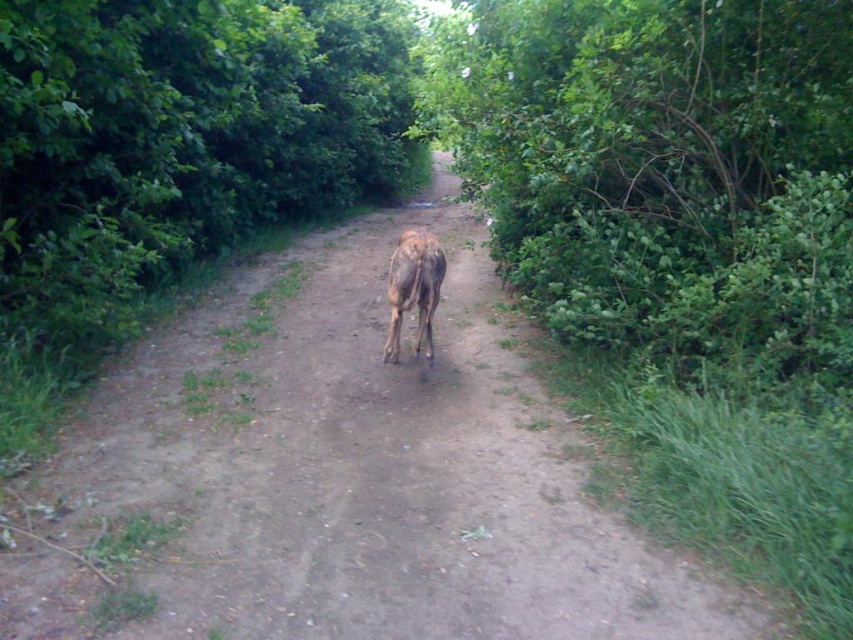
Question: Can you confirm if green leafy bush at right is positioned to the right of brown speckled fur at center?

Choices:
 (A) yes
 (B) no

Answer: (A)

Question: Which object is farther from the camera taking this photo?

Choices:
 (A) brown textured dirt path at center
 (B) green leafy tree at center
 (C) green leafy bush at right
 (D) brown speckled fur at center

Answer: (B)

Question: Does green leafy tree at center have a larger size compared to brown speckled fur at center?

Choices:
 (A) yes
 (B) no

Answer: (B)

Question: Which of the following is the closest to the observer?

Choices:
 (A) (26, 10)
 (B) (405, 262)

Answer: (A)

Question: Which object appears farthest from the camera in this image?

Choices:
 (A) brown speckled fur at center
 (B) green leafy bush at right
 (C) green leafy tree at center

Answer: (C)

Question: Does brown textured dirt path at center appear over green leafy bush at right?

Choices:
 (A) yes
 (B) no

Answer: (B)